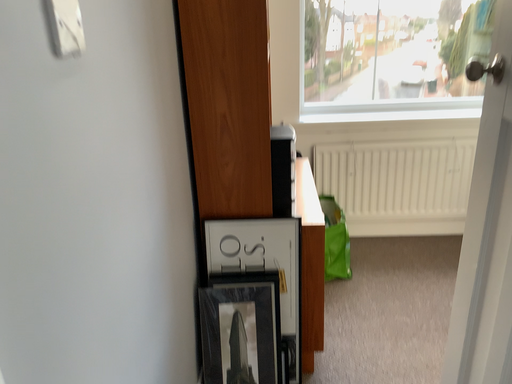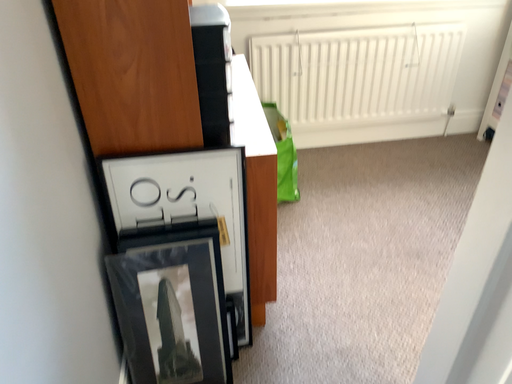
Question: Which way did the camera rotate in the video?

Choices:
 (A) rotated downward
 (B) rotated upward

Answer: (A)